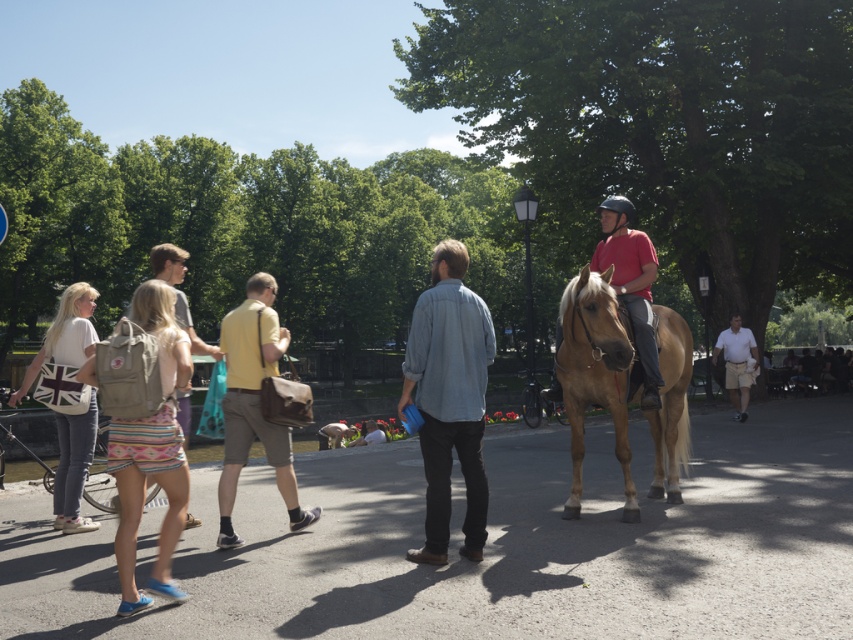
Does point (474, 508) lie in front of point (747, 336)?

Yes, point (474, 508) is in front of point (747, 336).

Where is `denim shirt at center`? Image resolution: width=853 pixels, height=640 pixels. denim shirt at center is located at coordinates pos(450,397).

Identify the location of denim shirt at center. (450, 397).

The height and width of the screenshot is (640, 853). What do you see at coordinates (450, 397) in the screenshot?
I see `denim shirt at center` at bounding box center [450, 397].

The image size is (853, 640). I want to click on denim shirt at center, so click(x=450, y=397).

Can you confirm if light brown glossy horse at center is positioned below yellow leather bag at center?

Yes, light brown glossy horse at center is below yellow leather bag at center.

Which is more to the left, light brown glossy horse at center or yellow leather bag at center?

yellow leather bag at center

Locate an element on the screen. Image resolution: width=853 pixels, height=640 pixels. light brown glossy horse at center is located at coordinates (595, 374).

Locate an element on the screen. This screenshot has height=640, width=853. light brown glossy horse at center is located at coordinates (595, 374).